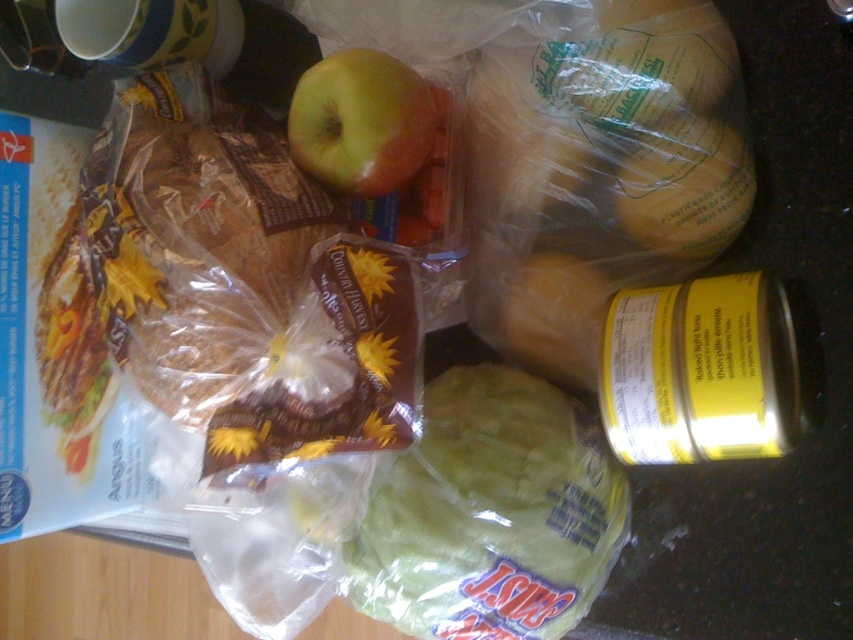
Question: Does green plastic cabbage at center have a greater width compared to green matte apple at center?

Choices:
 (A) yes
 (B) no

Answer: (A)

Question: Can you confirm if green plastic cabbage at center is wider than green matte apple at center?

Choices:
 (A) yes
 (B) no

Answer: (A)

Question: Which point is closer to the camera taking this photo?

Choices:
 (A) (405, 152)
 (B) (366, 582)

Answer: (A)

Question: Among these points, which one is farthest from the camera?

Choices:
 (A) (303, 108)
 (B) (434, 628)

Answer: (B)

Question: Where is green plastic cabbage at center located in relation to green matte apple at center in the image?

Choices:
 (A) left
 (B) right

Answer: (B)